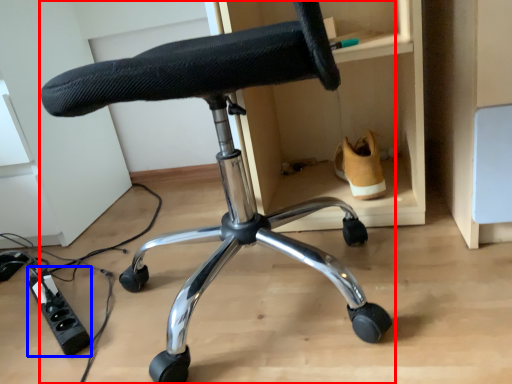
Question: Among these objects, which one is farthest to the camera, chair (highlighted by a red box) or plug (highlighted by a blue box)?

Choices:
 (A) chair
 (B) plug

Answer: (B)